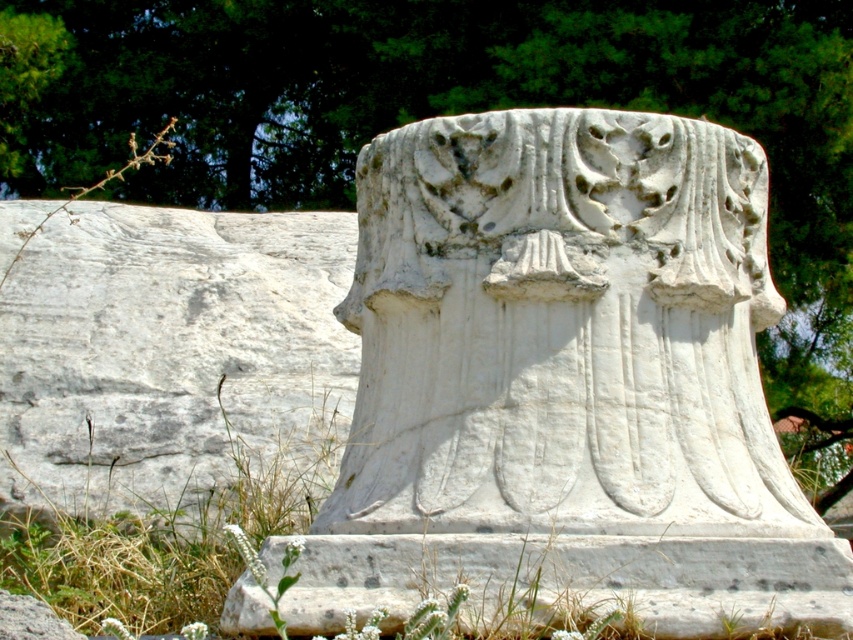
You are an archaeologist examining the ancient stone fragment. You notice a point marked at coordinates (x=566, y=380). What does this point indicate?

The point at coordinates (x=566, y=380) marks the white marble column at center.

You are an archaeologist examining the ancient stone fragment. You notice two points marked on the stone surface. The first point is at coordinates point (544, 294) and the second is at point (242, 515). Which of these two points is closer to you, the observer?

Point (544, 294) is in front of point (242, 515), so the first point is closer to you.

You are an archaeologist examining the ancient stone fragment. You notice the white marble column at center and the dry grass at lower left. Based on their positions, which object is located to the left of the other?

The dry grass at lower left is located to the left of the white marble column at center because the white marble column at center is positioned on the right side of dry grass at lower left.